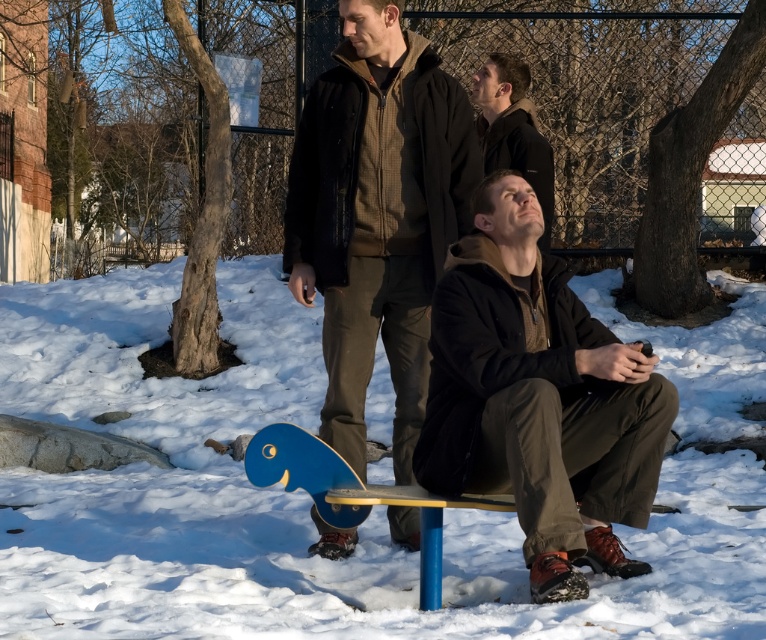
How distant is matte black jacket at center from blue plastic skateboard at lower center?

They are 30.88 inches apart.

Can you confirm if matte black jacket at center is positioned to the right of blue plastic skateboard at lower center?

Yes, matte black jacket at center is to the right of blue plastic skateboard at lower center.

Locate an element on the screen. matte black jacket at center is located at coordinates (538, 397).

Is dark brown jacket at center to the left of blue plastic skateboard at lower center from the viewer's perspective?

In fact, dark brown jacket at center is to the right of blue plastic skateboard at lower center.

Who is more distant from viewer, (398, 342) or (264, 481)?

Positioned behind is point (398, 342).

Is point (395, 200) in front of point (316, 445)?

No, (395, 200) is further to viewer.

The height and width of the screenshot is (640, 766). I want to click on dark brown jacket at center, so click(377, 216).

Is white fluffy snow at center taller than dark brown leather jacket at center?

In fact, white fluffy snow at center may be shorter than dark brown leather jacket at center.

Describe the element at coordinates (293, 499) in the screenshot. This screenshot has height=640, width=766. I see `white fluffy snow at center` at that location.

Locate an element on the screen. The height and width of the screenshot is (640, 766). white fluffy snow at center is located at coordinates (293, 499).